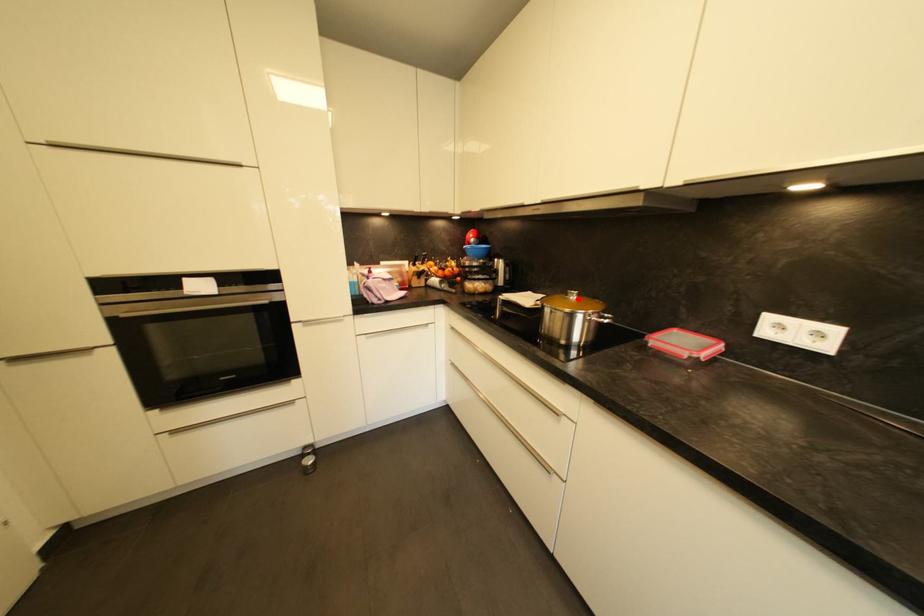
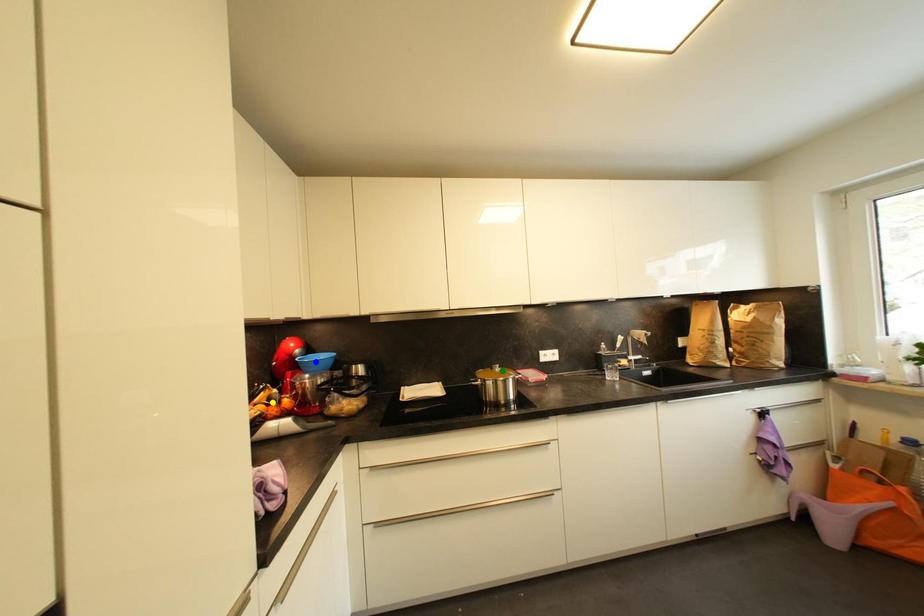
Question: I am providing you with two images of the same scene from different viewpoints. A red point is marked on the first image. You are given multiple points on the second image. Which point in image 2 represents the same 3d spot as the red point in image 1?

Choices:
 (A) yellow point
 (B) blue point
 (C) green point

Answer: (C)